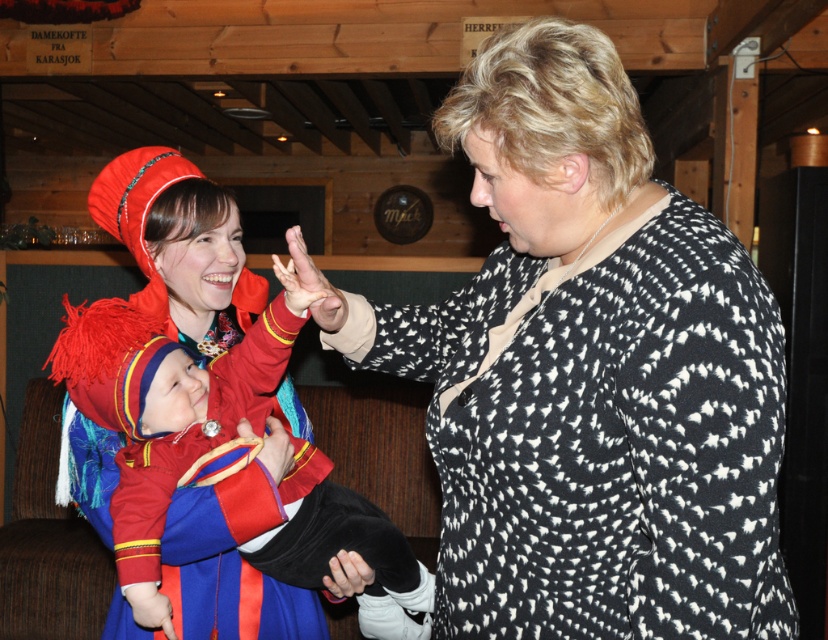
Locate an element on the screen. The height and width of the screenshot is (640, 828). black dotted sweater at center is located at coordinates pyautogui.click(x=591, y=372).

Who is more distant from viewer, [455,115] or [344,506]?

The point [344,506] is more distant.

At what (x,y) coordinates should I click in order to perform the action: click on black dotted sweater at center. Please return your answer as a coordinate pair (x, y). Looking at the image, I should click on (591, 372).

Is point (124, 332) positioned in front of point (285, 442)?

Yes, it is.

Which is below, velvet red dress at center or matte red fabric hand at center?

velvet red dress at center is below.

Between point (224, 419) and point (283, 440), which one is positioned behind?

The point (283, 440) is more distant.

Locate an element on the screen. velvet red dress at center is located at coordinates point(244,477).

This screenshot has width=828, height=640. What do you see at coordinates (244, 477) in the screenshot? I see `velvet red dress at center` at bounding box center [244, 477].

Which is below, velvet red dress at center or smooth black hand at center?

smooth black hand at center

What do you see at coordinates (244, 477) in the screenshot? I see `velvet red dress at center` at bounding box center [244, 477].

This screenshot has width=828, height=640. In order to click on velvet red dress at center in this screenshot , I will do `click(244, 477)`.